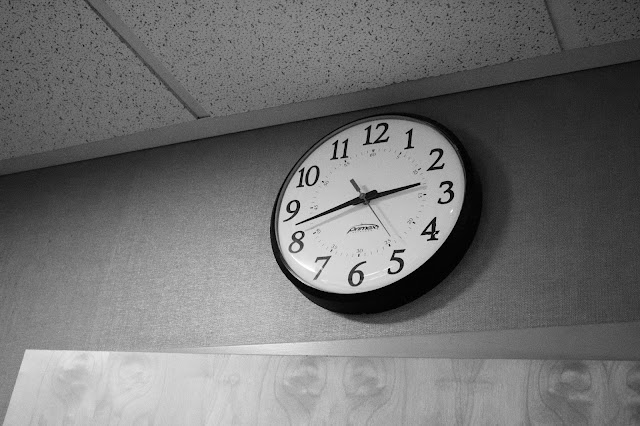
Find the location of a particular element. The image size is (640, 426). drop ceiling tile is located at coordinates (319, 50).